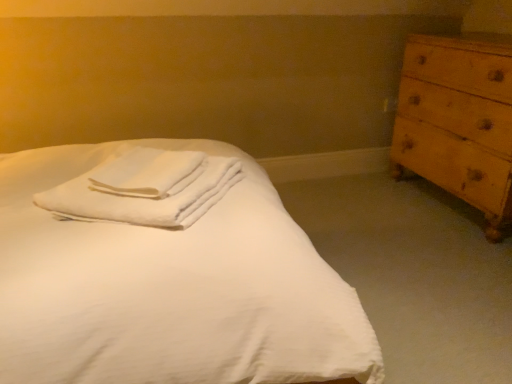
The image size is (512, 384). Find the location of `free area below wooden chest of drawers at right (from a real-world perspective)`. free area below wooden chest of drawers at right (from a real-world perspective) is located at coordinates coord(442,204).